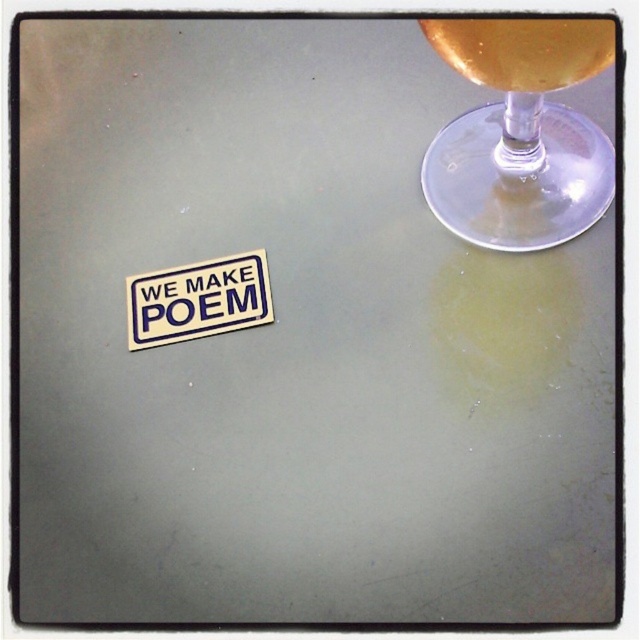
Question: Does transparent glass wine glass at upper right have a lesser width compared to white paper sticker at lower left?

Choices:
 (A) yes
 (B) no

Answer: (B)

Question: Which is farther from the transparent glass wine glass at upper right?

Choices:
 (A) translucent glass at upper right
 (B) white paper sticker at lower left

Answer: (B)

Question: Does transparent glass wine glass at upper right have a greater width compared to translucent glass at upper right?

Choices:
 (A) yes
 (B) no

Answer: (A)

Question: Is transparent glass wine glass at upper right positioned at the back of translucent glass at upper right?

Choices:
 (A) no
 (B) yes

Answer: (B)

Question: Which of the following is the farthest from the observer?

Choices:
 (A) translucent glass at upper right
 (B) white paper sticker at lower left

Answer: (B)

Question: Which of the following is the farthest from the observer?

Choices:
 (A) (259, 275)
 (B) (442, 204)

Answer: (B)